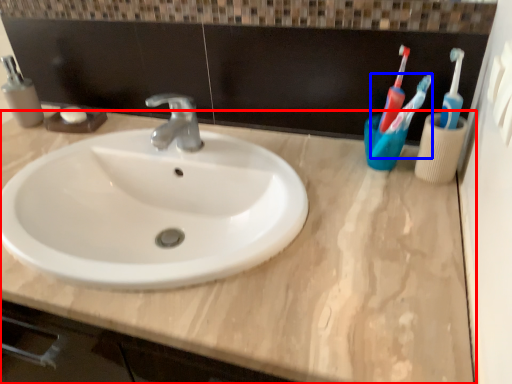
Question: Which object appears closest to the camera in this image, counter top (highlighted by a red box) or toothbrush (highlighted by a blue box)?

Choices:
 (A) counter top
 (B) toothbrush

Answer: (A)